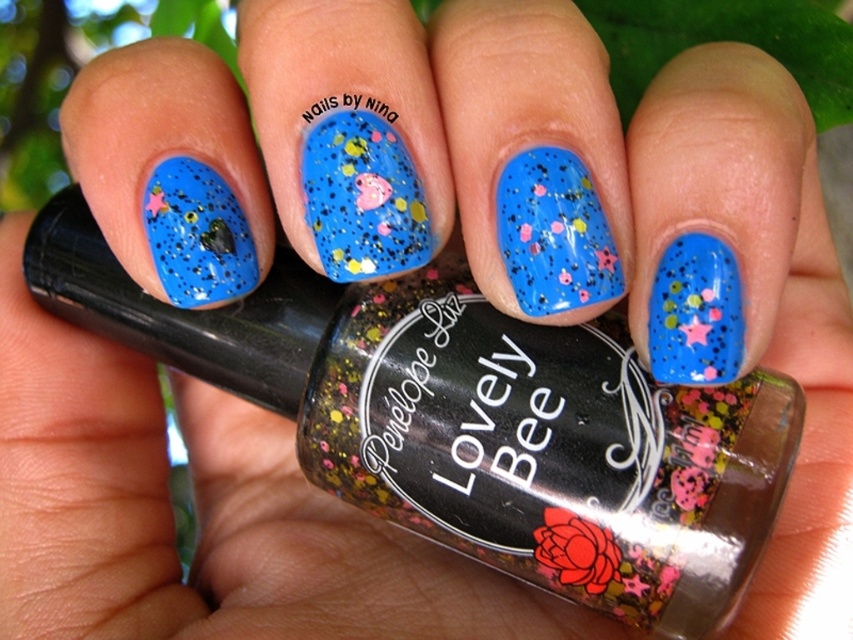
Who is positioned more to the right, glittery blue nail art with colorful speckles at center or glittery blue nail at center?

Positioned to the right is glittery blue nail at center.

Is point (351, 138) farther from camera compared to point (550, 225)?

Yes, point (351, 138) is farther from viewer.

Find the location of a particular element. The width and height of the screenshot is (853, 640). glittery blue nail art with colorful speckles at center is located at coordinates (x=363, y=196).